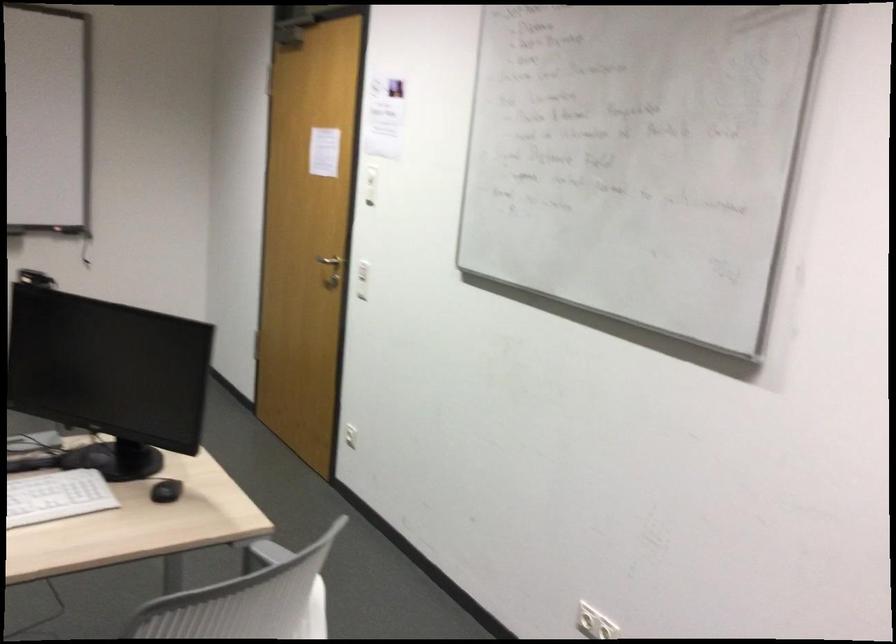
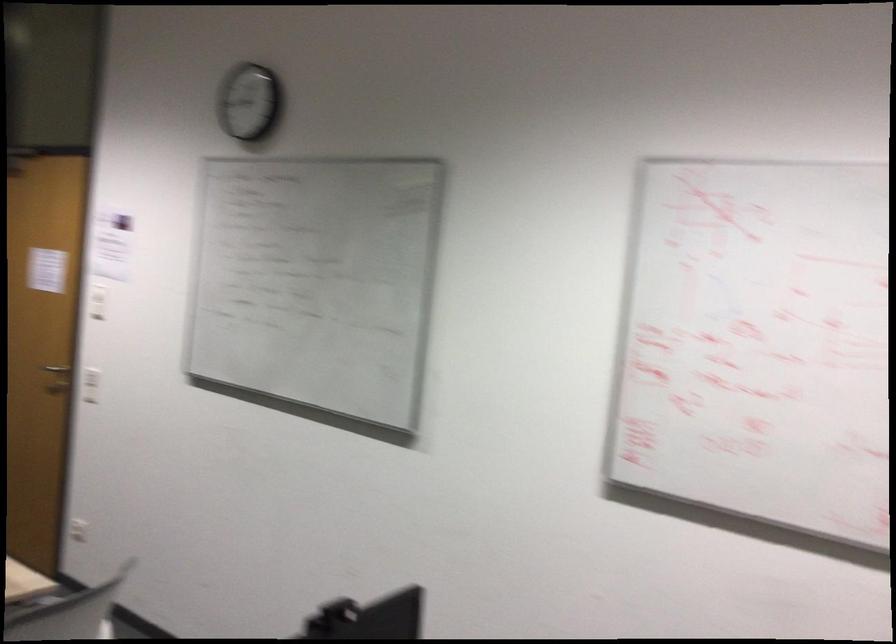
In the second image, find the point that corresponds to [350,176] in the first image.

(97, 301)